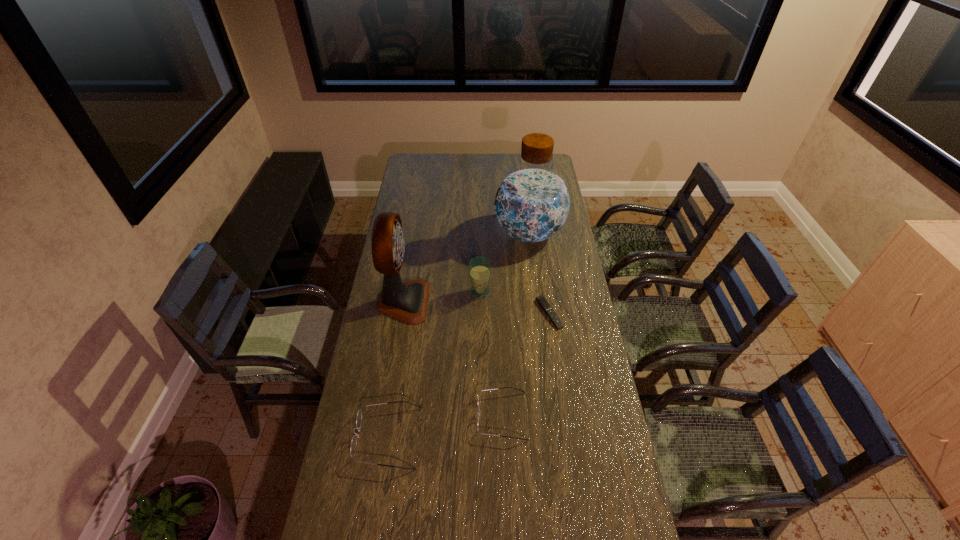
Identify the location of free space for a new spectacles on the right. (608, 396).